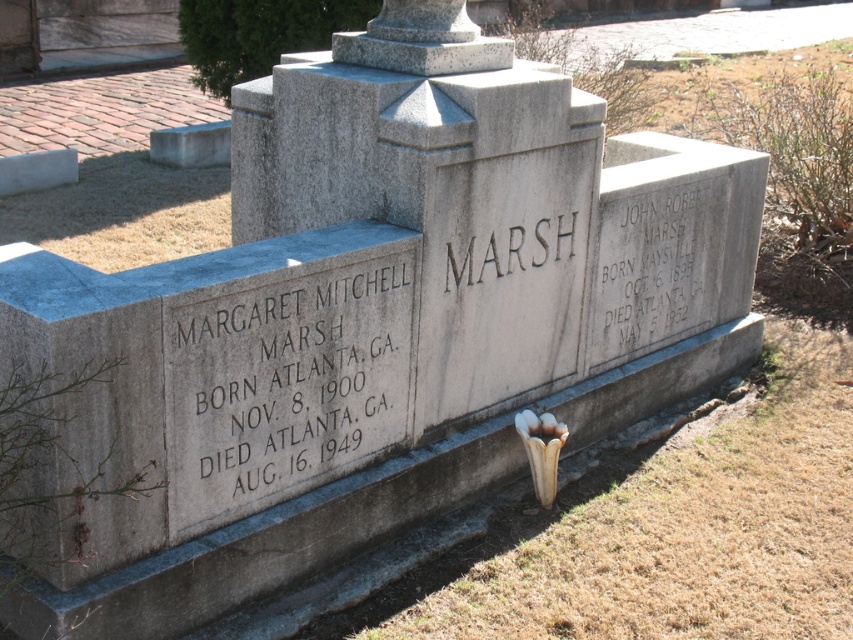
Question: Can you confirm if matte gray stone inscription at upper right is positioned below black engraved text at center?

Choices:
 (A) no
 (B) yes

Answer: (B)

Question: Considering the real-world distances, which object is closest to the white stone plaque at center?

Choices:
 (A) black engraved text at center
 (B) matte gray stone inscription at upper right

Answer: (A)

Question: Can you confirm if white stone plaque at center is smaller than black engraved text at center?

Choices:
 (A) no
 (B) yes

Answer: (A)

Question: Which of the following is the closest to the observer?

Choices:
 (A) black engraved text at center
 (B) matte gray stone inscription at upper right
 (C) white stone plaque at center

Answer: (C)

Question: Which point is closer to the camera?

Choices:
 (A) black engraved text at center
 (B) white stone plaque at center

Answer: (B)

Question: Is white stone plaque at center positioned in front of black engraved text at center?

Choices:
 (A) no
 (B) yes

Answer: (B)